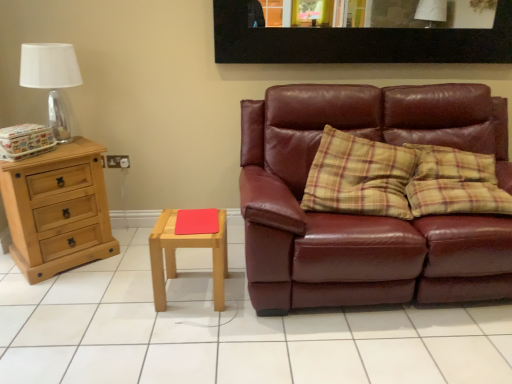
The width and height of the screenshot is (512, 384). I want to click on free space in front of light brown wooden stool at center, so click(x=186, y=331).